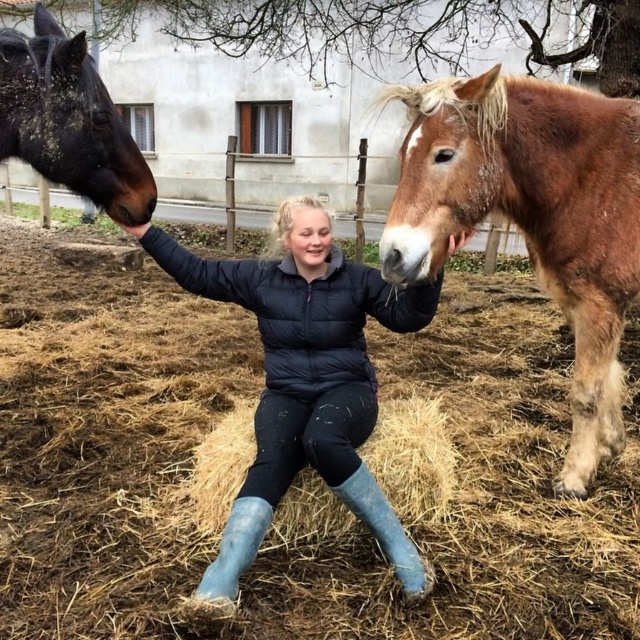
Is brown fuzzy horse at upper right further to the viewer compared to shiny black horse at left?

No, it is not.

Who is positioned more to the left, brown fuzzy horse at upper right or shiny black horse at left?

From the viewer's perspective, shiny black horse at left appears more on the left side.

Does point (412, 230) lie in front of point (3, 120)?

That is True.

At what (x,y) coordinates should I click in order to perform the action: click on brown fuzzy horse at upper right. Please return your answer as a coordinate pair (x, y). Looking at the image, I should click on (532, 216).

Does brown dry hay at center have a larger size compared to black matte jacket at center?

Incorrect, brown dry hay at center is not larger than black matte jacket at center.

Can you confirm if brown dry hay at center is positioned to the right of black matte jacket at center?

In fact, brown dry hay at center is to the left of black matte jacket at center.

Describe the element at coordinates (472, 497) in the screenshot. The height and width of the screenshot is (640, 640). I see `brown dry hay at center` at that location.

Locate an element on the screen. Image resolution: width=640 pixels, height=640 pixels. brown dry hay at center is located at coordinates (472, 497).

Between point (3, 444) and point (61, 65), which one is positioned in front?

Point (61, 65) is in front.

This screenshot has width=640, height=640. Identify the location of brown dry hay at center. (472, 497).

Is point (589, 545) more distant than point (72, 51)?

Yes, point (589, 545) is behind point (72, 51).

Find the location of a particular element. brown dry hay at center is located at coordinates (472, 497).